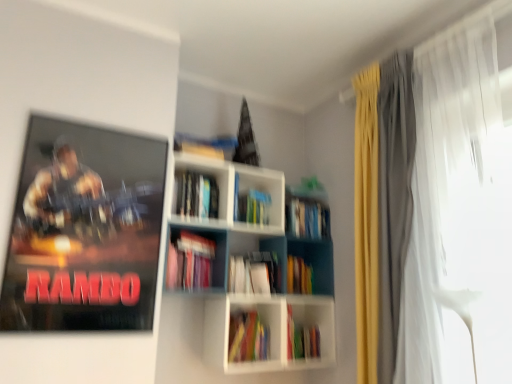
Question: Looking at their shapes, would you say multicolored paper at center, marked as the 2th book in a bottom-to-top arrangement, is wider or thinner than matte pink book at center, acting as the 4th book starting from the bottom?

Choices:
 (A) wide
 (B) thin

Answer: (A)

Question: From the image's perspective, relative to matte pink book at center, acting as the 4th book starting from the bottom, is multicolored paper at center, marked as the 2th book in a bottom-to-top arrangement, above or below?

Choices:
 (A) above
 (B) below

Answer: (B)

Question: Which of these objects is positioned farthest from the multicolored paper book at center, acting as the 4th book starting from the top?

Choices:
 (A) white matte bookshelf at center, acting as the 6th book starting from the bottom
 (B) white sheer curtain at right
 (C) hardcover book at center, which is the 5th book from bottom to top
 (D) multicolored paper at center, placed as the first book when sorted from bottom to top
 (E) multicolored paper at center, positioned as the fifth book in top-to-bottom order

Answer: (B)

Question: Based on their relative distances, which object is nearer to the metallic rambo poster at upper left?

Choices:
 (A) multicolored paper book at center, the 3th book positioned from the bottom
 (B) multicolored paper at center, positioned as the sixth book in top-to-bottom order
 (C) matte pink book at center, acting as the 4th book starting from the bottom
 (D) white plastic bookcase at center
 (E) multicolored paper at center, marked as the 2th book in a bottom-to-top arrangement

Answer: (C)